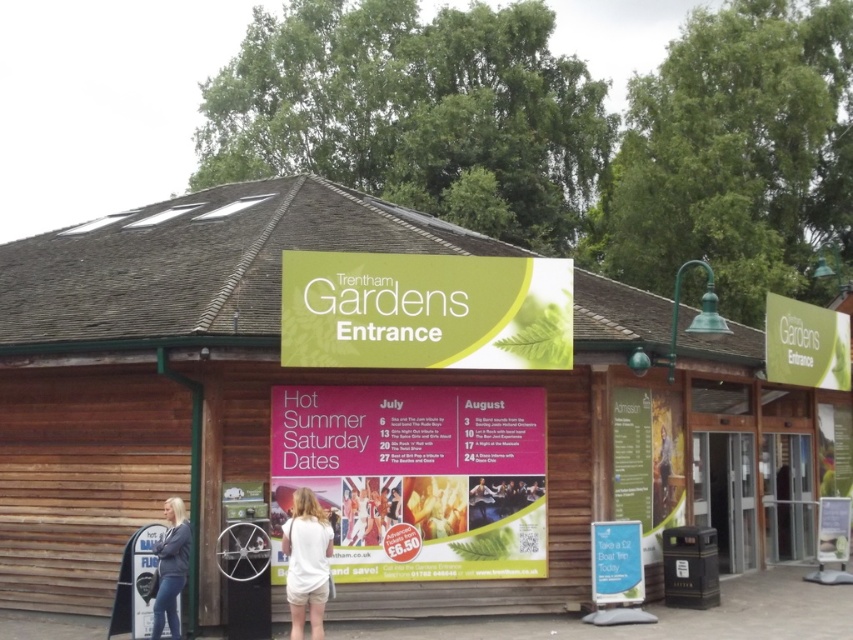
You are planning to hang a new sign at Trentham Gardens entrance. The new sign must be smaller than both the pink paper poster at center and the green matte sign at upper right. Can you place the new sign between them without overlapping either?

The pink paper poster at center occupies less space than the green matte sign at upper right. Since the new sign must be smaller than both, it can be placed between them without overlapping either as long as it fits within the available space between the two existing signs.

You are standing at the entrance of Trentham Gardens and notice both the green matte sign at center and the white cotton shirt at center. Which object is shorter in height?

The green matte sign at center is not as tall as the white cotton shirt at center, so the green matte sign at center is shorter in height.

You are at the entrance of Trentham Gardens and notice the wooden sign at center and the blonde hair at entrance. Which object is wider?

The wooden sign at center is wider than the blonde hair at entrance.